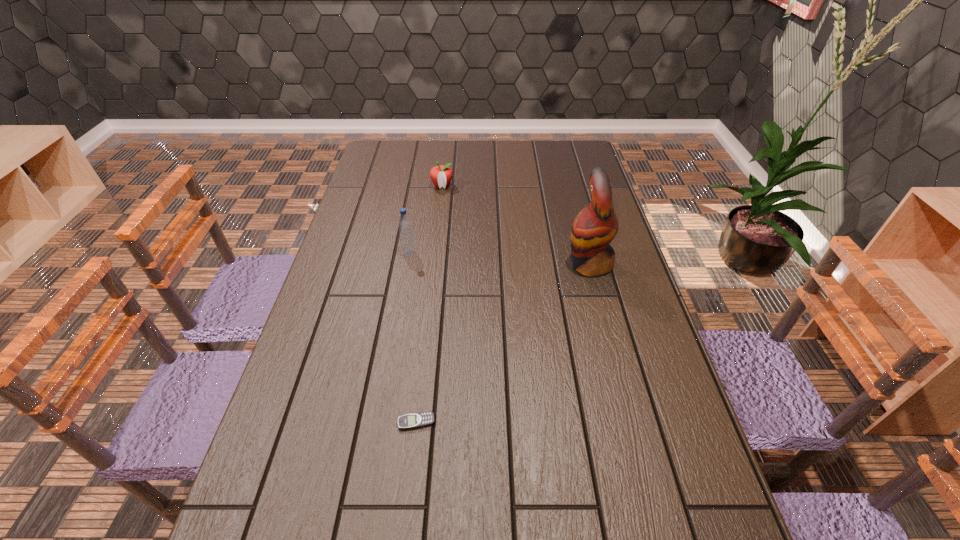
Locate an element on the screen. The height and width of the screenshot is (540, 960). vacant space situated on the face of the rightmost object is located at coordinates (450, 264).

The image size is (960, 540). I want to click on free space located on the front of the leftmost object, so click(401, 297).

The height and width of the screenshot is (540, 960). I want to click on vacant space located on the back of the farthest object, so click(x=445, y=159).

Find the location of a particular element. Image resolution: width=960 pixels, height=540 pixels. free space located 0.190m on the left of the shortest object is located at coordinates (312, 422).

Where is `object positioned at the right edge`? This screenshot has width=960, height=540. object positioned at the right edge is located at coordinates (596, 225).

This screenshot has height=540, width=960. What are the coordinates of `vacant space at the far edge` in the screenshot? It's located at (482, 148).

Where is `blank space at the left edge`? The image size is (960, 540). blank space at the left edge is located at coordinates (355, 211).

At what (x,y) coordinates should I click in order to perform the action: click on free space at the right edge of the desktop. Please return your answer as a coordinate pair (x, y). The image size is (960, 540). Looking at the image, I should click on (570, 206).

The height and width of the screenshot is (540, 960). I want to click on vacant space at the far left corner, so click(393, 152).

You are a GUI agent. You are given a task and a screenshot of the screen. Output one action in this format:
    pyautogui.click(x=<x>, y=<y>)
    Task: Click on the free point between the nearest object and the third tallest object
    
    Given the screenshot: What is the action you would take?
    pyautogui.click(x=429, y=304)